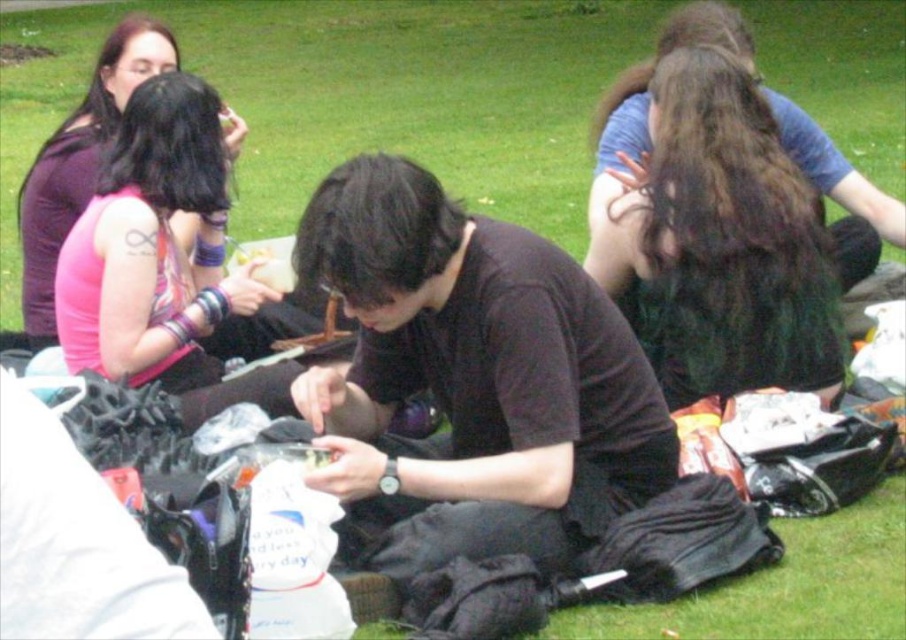
Question: Does black matte shirt at center have a greater width compared to pink fabric bracelet at upper left?

Choices:
 (A) yes
 (B) no

Answer: (A)

Question: Where is black matte shirt at center located in relation to dark brown hair at upper right in the image?

Choices:
 (A) above
 (B) below

Answer: (B)

Question: Which object is farther from the camera taking this photo?

Choices:
 (A) dark brown hair at upper right
 (B) pink fabric bracelet at upper left

Answer: (B)

Question: Considering the relative positions of black matte shirt at center and dark brown hair at upper right in the image provided, where is black matte shirt at center located with respect to dark brown hair at upper right?

Choices:
 (A) right
 (B) left

Answer: (B)

Question: Which object appears farthest from the camera in this image?

Choices:
 (A) pink fabric bracelet at upper left
 (B) dark brown hair at upper right
 (C) black matte shirt at center

Answer: (A)

Question: Which object appears closest to the camera in this image?

Choices:
 (A) dark brown hair at upper right
 (B) black matte shirt at center
 (C) pink fabric bracelet at upper left

Answer: (B)